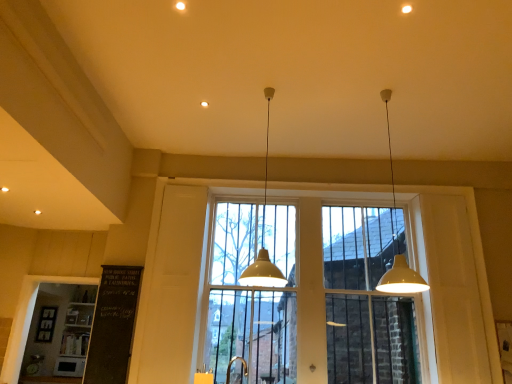
Question: Considering the positions of point (345, 312) and point (234, 357), is point (345, 312) closer or farther from the camera than point (234, 357)?

Choices:
 (A) closer
 (B) farther

Answer: (B)

Question: From a real-world perspective, relative to gold metallic faucet at lower center, is clear glass window at center vertically above or below?

Choices:
 (A) below
 (B) above

Answer: (B)

Question: Which object is the farthest from the white matte pendant light at center, which is counted as the 2th lamp, starting from the right?

Choices:
 (A) white matte pendant light at upper right, acting as the second lamp starting from the left
 (B) white wood window frame at lower left
 (C) gold metallic faucet at lower center
 (D) clear glass window at center

Answer: (B)

Question: Estimate the real-world distances between objects in this image. Which object is closer to the white matte pendant light at upper right, acting as the second lamp starting from the left?

Choices:
 (A) white matte pendant light at center, which is counted as the 2th lamp, starting from the right
 (B) gold metallic faucet at lower center
 (C) white wood window frame at lower left
 (D) clear glass window at center

Answer: (A)